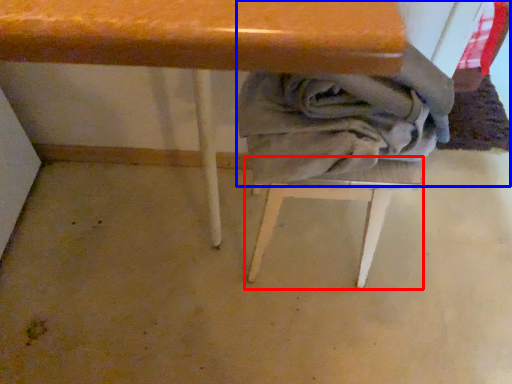
Question: Which object is further to the camera taking this photo, step stool (highlighted by a red box) or laundry (highlighted by a blue box)?

Choices:
 (A) step stool
 (B) laundry

Answer: (A)